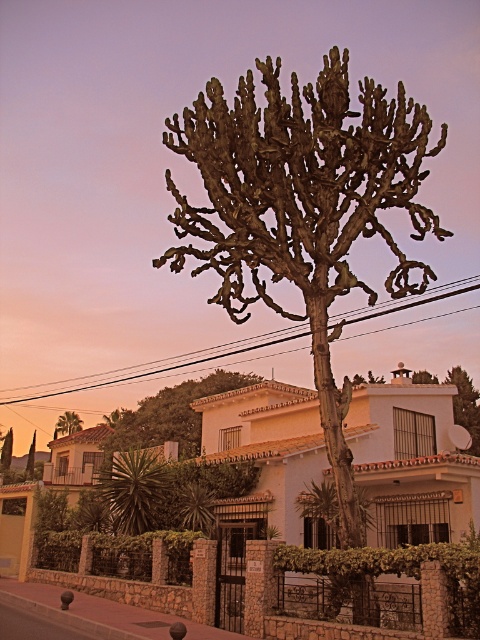
You are a gardener standing on the sidewalk and want to prune both the green spiky plant at lower left and the green leafy tree at upper left. Which plant requires a ladder to reach its top?

The green spiky plant at lower left requires a ladder to reach its top since it has a greater height compared to the green leafy tree at upper left.